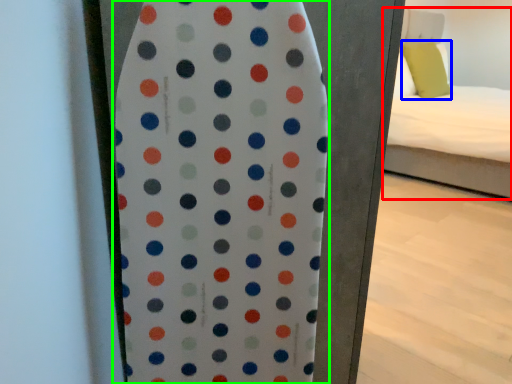
Question: Estimate the real-world distances between objects in this image. Which object is farther from bed (highlighted by a red box), pillow (highlighted by a blue box) or surfboard (highlighted by a green box)?

Choices:
 (A) pillow
 (B) surfboard

Answer: (B)